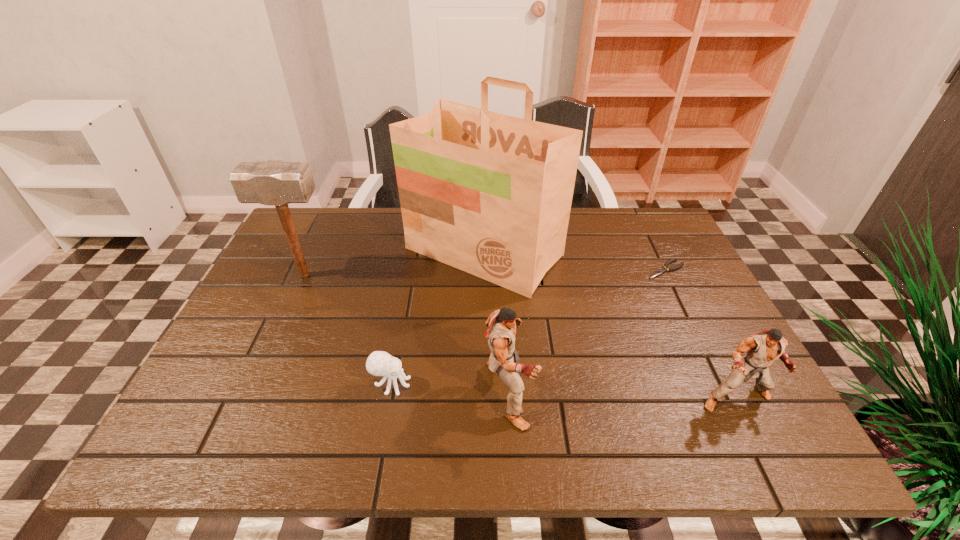
At what (x,y) coordinates should I click in order to perform the action: click on the taller puncher. Please return your answer as a coordinate pair (x, y). The height and width of the screenshot is (540, 960). Looking at the image, I should click on (504, 359).

Locate an element on the screen. the fourth shortest object is located at coordinates (504, 359).

Locate an element on the screen. the third shortest object is located at coordinates (763, 348).

Where is `the right puncher`? The image size is (960, 540). the right puncher is located at coordinates (763, 348).

You are a GUI agent. You are given a task and a screenshot of the screen. Output one action in this format:
    pyautogui.click(x=<x>, y=<y>)
    Task: Click on the tallest object
    
    Given the screenshot: What is the action you would take?
    pyautogui.click(x=489, y=194)

In order to click on the shortest object in this screenshot , I will do `click(659, 272)`.

Identify the location of mallet. The image size is (960, 540). (278, 183).

You are a GUI agent. You are given a task and a screenshot of the screen. Output one action in this format:
    pyautogui.click(x=<x>, y=<y>)
    Task: Click on the second tallest object
    This screenshot has width=960, height=540.
    Given the screenshot: What is the action you would take?
    pyautogui.click(x=278, y=183)

You are a GUI agent. You are given a task and a screenshot of the screen. Output one action in this format:
    pyautogui.click(x=<x>, y=<y>)
    Task: Click on the second shortest object
    The image size is (960, 540).
    Given the screenshot: What is the action you would take?
    pyautogui.click(x=379, y=363)

You are a GUI agent. You are given a task and a screenshot of the screen. Output one action in this format:
    pyautogui.click(x=<x>, y=<y>)
    Task: Click on the free region located on the front-facing side of the left puncher
    
    Given the screenshot: What is the action you would take?
    pyautogui.click(x=674, y=393)